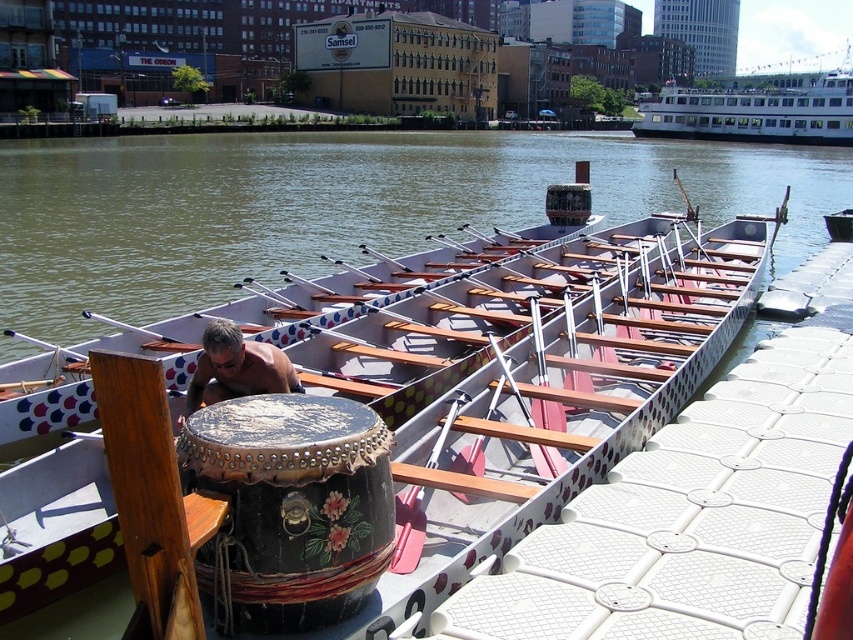
Image resolution: width=853 pixels, height=640 pixels. Describe the element at coordinates (335, 205) in the screenshot. I see `brown wooden boat at center` at that location.

Is brown wooden boat at center positioned at the back of black painted wood drum at center?

Yes, brown wooden boat at center is behind black painted wood drum at center.

The width and height of the screenshot is (853, 640). I want to click on brown wooden boat at center, so click(335, 205).

Where is `brown wooden boat at center`? brown wooden boat at center is located at coordinates click(335, 205).

Based on the photo, who is positioned more to the left, black painted wood drum at center or white glossy ferry at upper right?

Positioned to the left is black painted wood drum at center.

Who is more distant from viewer, (287,406) or (682,88)?

Point (682,88)

Where is `black painted wood drum at center`? This screenshot has width=853, height=640. black painted wood drum at center is located at coordinates pyautogui.click(x=289, y=508).

Can you confirm if black painted wood drum at center is smaller than smooth brown skin at center?

No.

Can you confirm if black painted wood drum at center is bigger than smooth brown skin at center?

Correct, black painted wood drum at center is larger in size than smooth brown skin at center.

What do you see at coordinates (289, 508) in the screenshot?
I see `black painted wood drum at center` at bounding box center [289, 508].

Where is `black painted wood drum at center`? This screenshot has height=640, width=853. black painted wood drum at center is located at coordinates tap(289, 508).